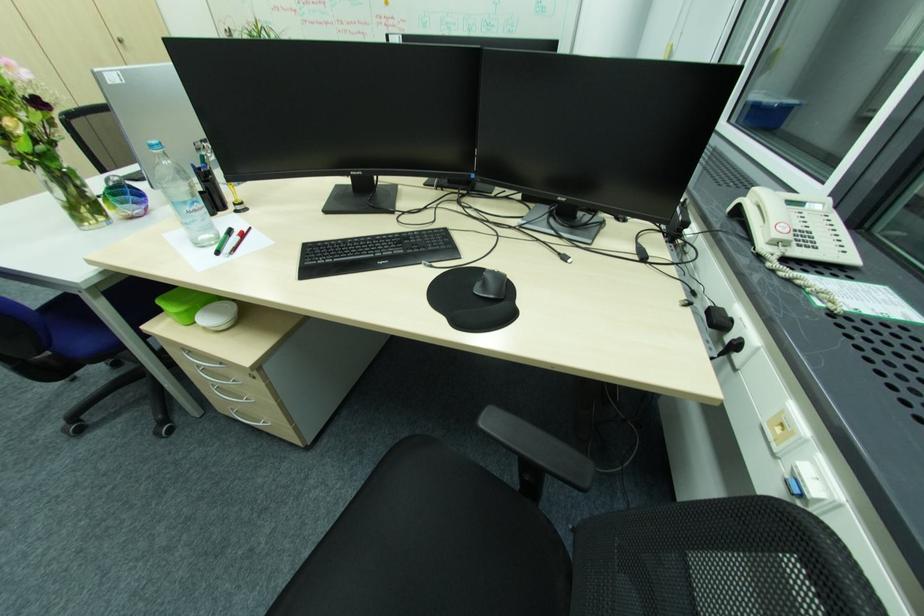
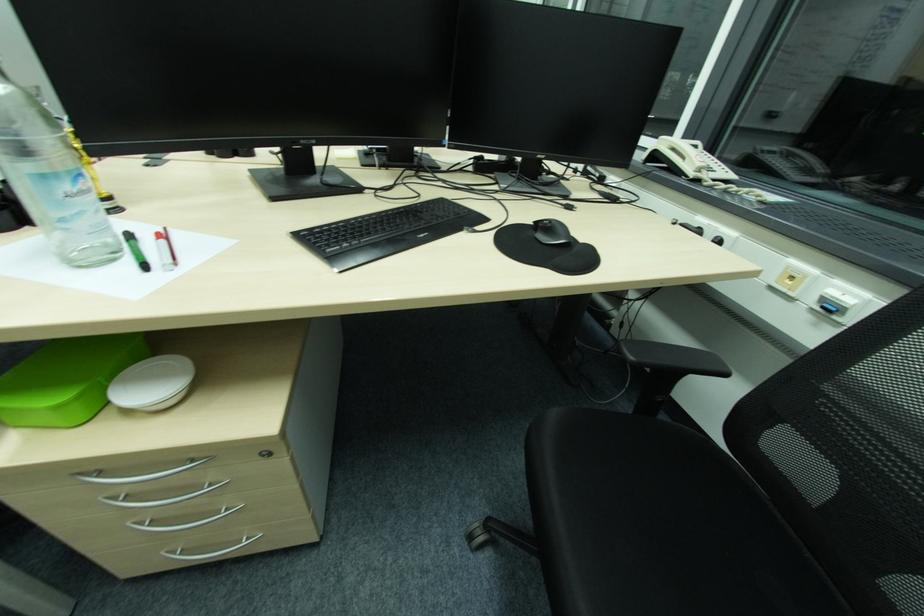
The point at (x=201, y=208) is marked in the first image. Where is the corresponding point in the second image?

(83, 185)